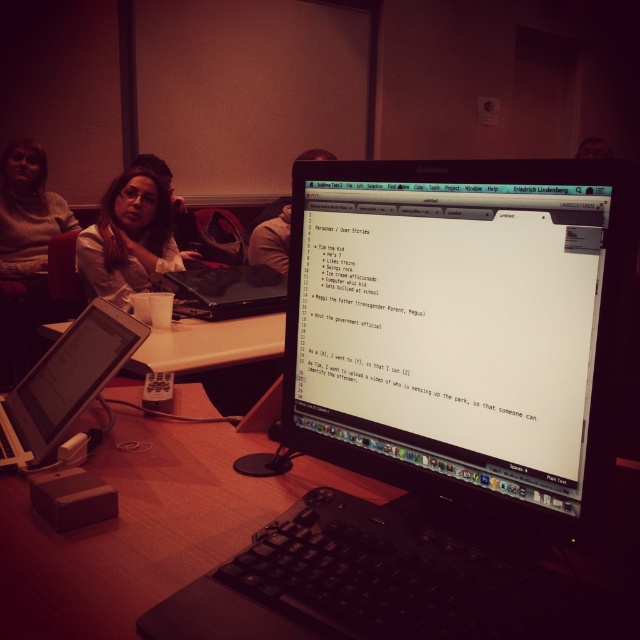
You are standing in the room and need to locate the silver metallic laptop at lower left. What are the coordinates of its position?

The silver metallic laptop at lower left is located at coordinates point (65, 381).

You are a person with a 18 inch wide laptop. You are standing in the room and want to place your laptop between the matte white shirt at upper left and the white plastic table at center. Is there enough space between them to fit your laptop?

The distance between the matte white shirt at upper left and the white plastic table at center is 19.65 inches. Since your laptop is 18 inches wide, there is enough space to fit it between them.

You are a photographer standing in the room and want to take a photo of the white plastic table at center. However, the matte white shirt at upper left is blocking your view. Can you determine which object is taller and needs to be moved to get an unobstructed view?

The matte white shirt at upper left is taller than the white plastic table at center, so you need to move the matte white shirt at upper left to get an unobstructed view.